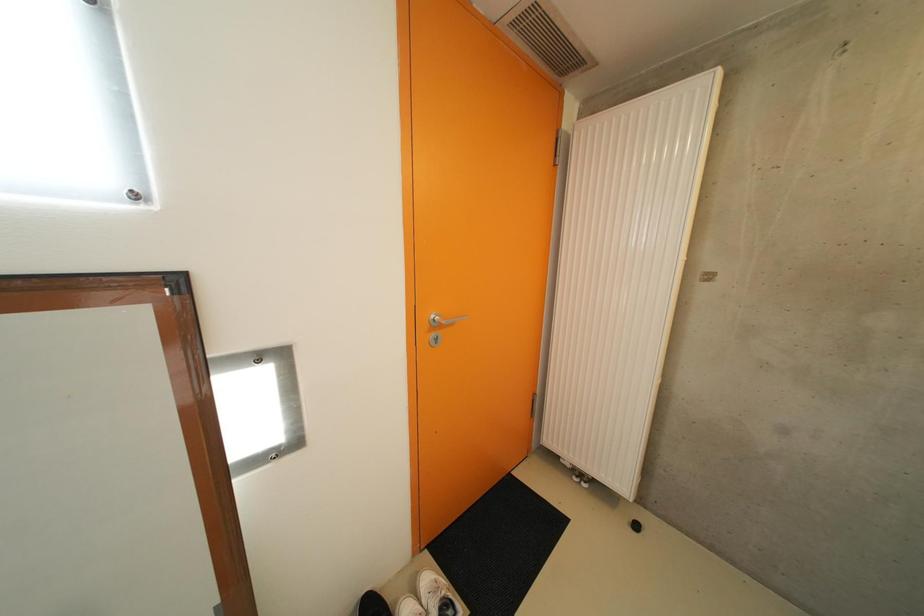
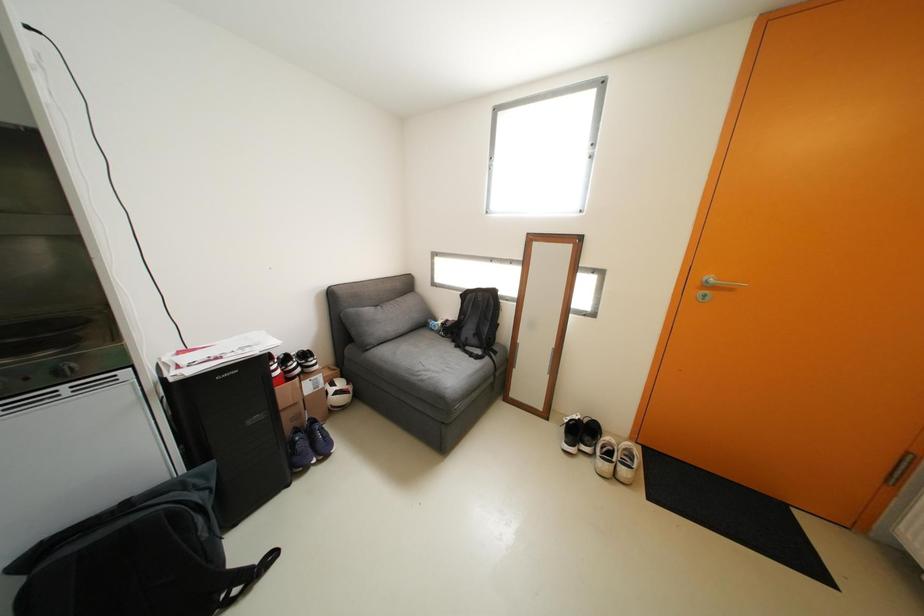
Question: The camera is either moving clockwise (left) or counter-clockwise (right) around the object. The first image is from the beginning of the video and the second image is from the end. Is the camera moving left or right when shooting the video?

Choices:
 (A) Left
 (B) Right

Answer: (B)